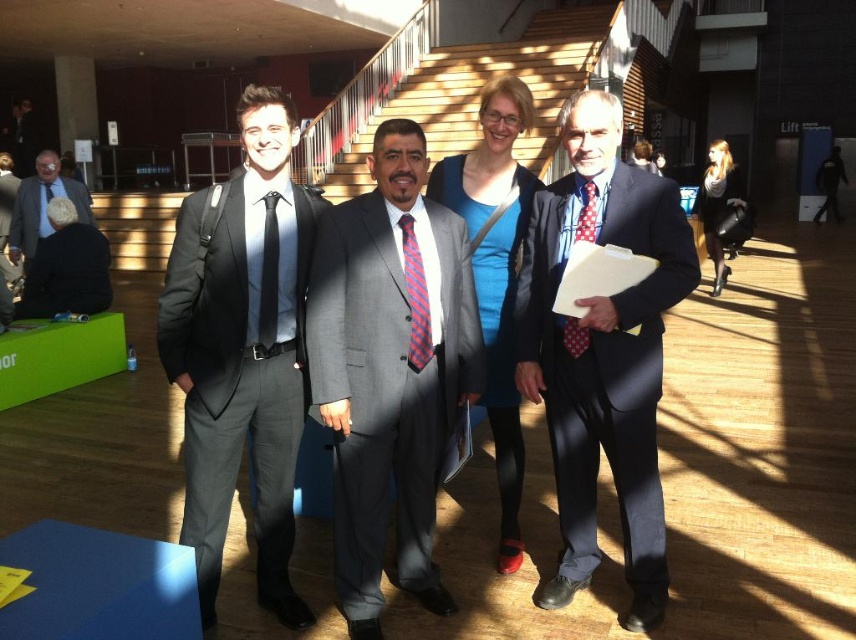
You are standing at the entrance of the room and want to approach the gray suit at center. According to the coordinates provided, what direction should you move in to reach them?

The gray suit at center is located at coordinates point (390,369), so you should move towards the center of the room to reach them.

You are standing at the entrance of the room and want to greet the group of four individuals. If you walk straight ahead, will you reach the gray suit at center before or after passing the point marked at coordinates point [390,369]?

The gray suit at center is located exactly at the point marked at coordinates point [390,369], so you will reach them right at that point.